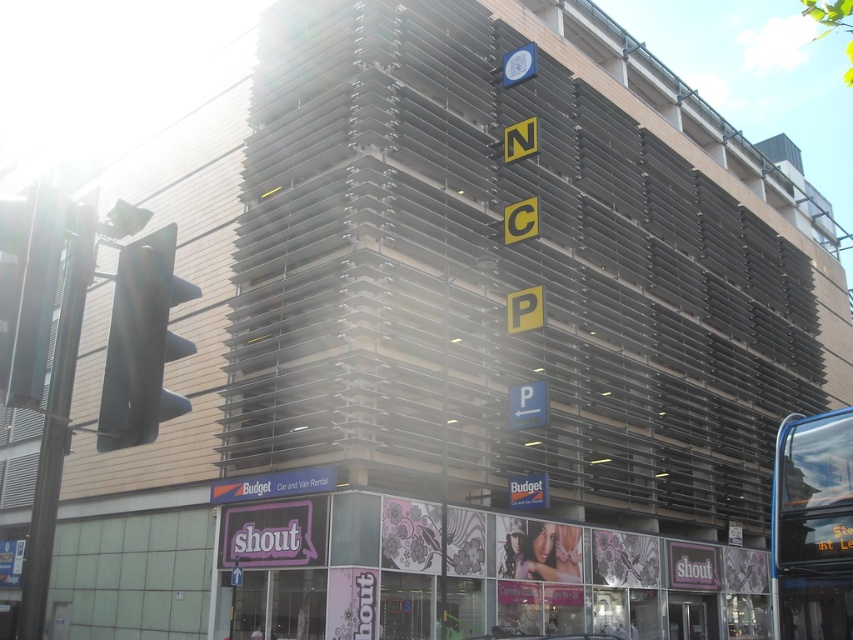
Question: Is transparent glass bus at lower right further to the viewer compared to black plastic traffic light at left?

Choices:
 (A) yes
 (B) no

Answer: (A)

Question: Does transparent glass bus at lower right appear over black plastic traffic light at left?

Choices:
 (A) yes
 (B) no

Answer: (B)

Question: Can you confirm if transparent glass bus at lower right is thinner than black plastic traffic light at left?

Choices:
 (A) yes
 (B) no

Answer: (B)